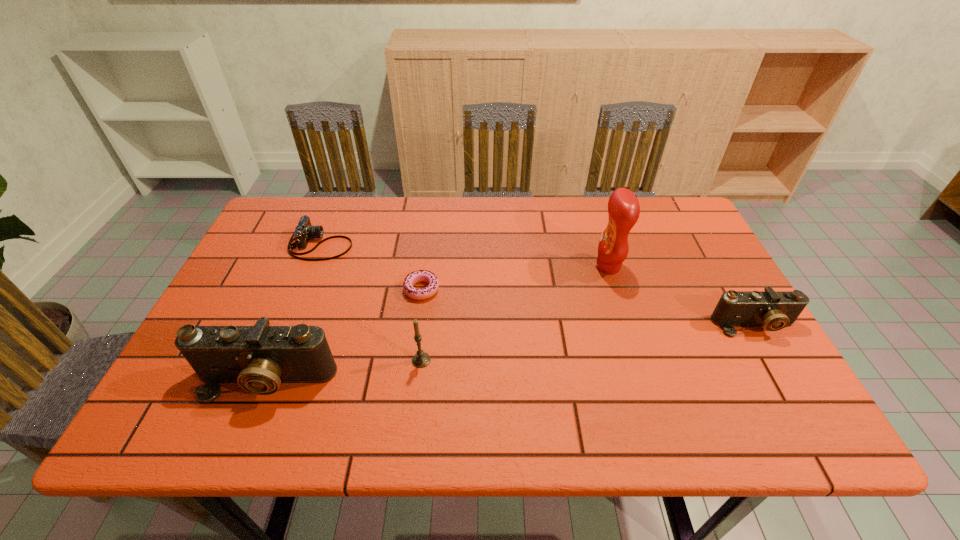
Identify the location of vacant region located on the front-facing side of the farthest camera. (479, 244).

Where is `blank space located on the label side of the tallest object`? Image resolution: width=960 pixels, height=540 pixels. blank space located on the label side of the tallest object is located at coordinates (491, 267).

In order to click on vacant space located on the label side of the tallest object in this screenshot , I will do `click(555, 267)`.

You are a GUI agent. You are given a task and a screenshot of the screen. Output one action in this format:
    pyautogui.click(x=<x>, y=<y>)
    Task: Click on the vacant region located 0.050m on the label side of the tallest object
    The height and width of the screenshot is (540, 960).
    Given the screenshot: What is the action you would take?
    pyautogui.click(x=577, y=267)

Where is `free space located on the right of the doughnut`? The image size is (960, 540). free space located on the right of the doughnut is located at coordinates (519, 289).

The height and width of the screenshot is (540, 960). I want to click on vacant space located 0.170m on the right of the candle, so click(x=506, y=360).

Locate an element on the screen. This screenshot has height=540, width=960. object at the far edge is located at coordinates tap(304, 231).

Where is `camera situated at the near edge`? camera situated at the near edge is located at coordinates (259, 358).

This screenshot has height=540, width=960. I want to click on candle at the near edge, so click(421, 359).

Locate an element on the screen. Image resolution: width=960 pixels, height=540 pixels. object that is at the right edge is located at coordinates (774, 310).